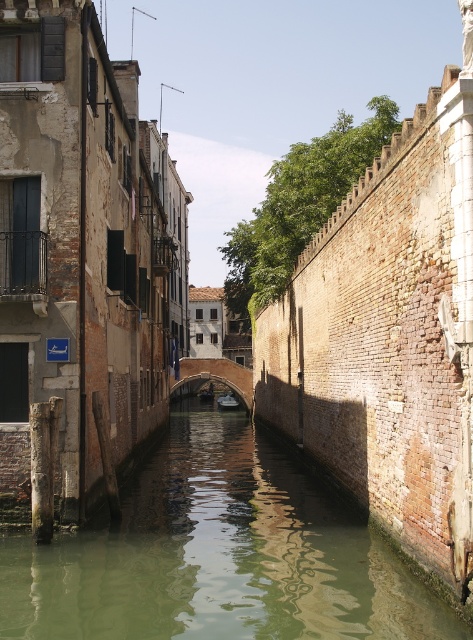
Question: Which point is closer to the camera?

Choices:
 (A) (360, 557)
 (B) (233, 362)

Answer: (A)

Question: Does greenish water at center have a smaller size compared to wooden boat at center?

Choices:
 (A) no
 (B) yes

Answer: (A)

Question: Is the position of greenish water at center less distant than that of dark brown stone bridge at center?

Choices:
 (A) yes
 (B) no

Answer: (A)

Question: Which point is farther to the camera?

Choices:
 (A) (318, 493)
 (B) (231, 384)

Answer: (B)

Question: Is greenish water at center smaller than dark brown stone bridge at center?

Choices:
 (A) no
 (B) yes

Answer: (B)

Question: Which point is closer to the camera?

Choices:
 (A) greenish water at center
 (B) wooden boat at center

Answer: (A)